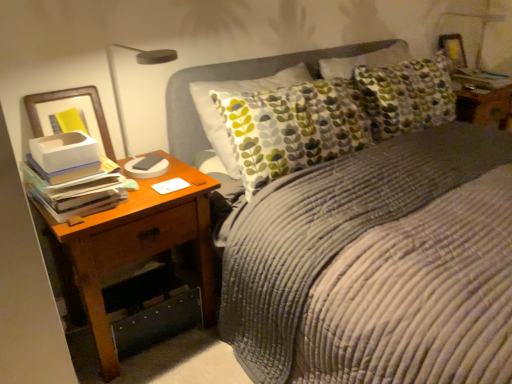
Question: From a real-world perspective, is brown wood nightstand at left below corduroy fabric bed at center?

Choices:
 (A) yes
 (B) no

Answer: (A)

Question: Considering the relative positions of brown wood nightstand at left and corduroy fabric bed at center in the image provided, is brown wood nightstand at left in front of corduroy fabric bed at center?

Choices:
 (A) no
 (B) yes

Answer: (A)

Question: From the image's perspective, is brown wood nightstand at left on corduroy fabric bed at center?

Choices:
 (A) no
 (B) yes

Answer: (A)

Question: Would you consider brown wood nightstand at left to be distant from corduroy fabric bed at center?

Choices:
 (A) no
 (B) yes

Answer: (A)

Question: Is brown wood nightstand at left located outside corduroy fabric bed at center?

Choices:
 (A) yes
 (B) no

Answer: (B)

Question: Considering the relative sizes of brown wood nightstand at left and corduroy fabric bed at center in the image provided, is brown wood nightstand at left thinner than corduroy fabric bed at center?

Choices:
 (A) no
 (B) yes

Answer: (B)

Question: Does corduroy fabric bed at center appear on the right side of brown wood nightstand at left?

Choices:
 (A) no
 (B) yes

Answer: (B)

Question: From a real-world perspective, is corduroy fabric bed at center located beneath brown wood nightstand at left?

Choices:
 (A) no
 (B) yes

Answer: (A)

Question: From a real-world perspective, is corduroy fabric bed at center located higher than brown wood nightstand at left?

Choices:
 (A) yes
 (B) no

Answer: (A)

Question: Is corduroy fabric bed at center touching brown wood nightstand at left?

Choices:
 (A) yes
 (B) no

Answer: (B)

Question: From the image's perspective, would you say corduroy fabric bed at center is positioned over brown wood nightstand at left?

Choices:
 (A) no
 (B) yes

Answer: (B)

Question: Can you confirm if corduroy fabric bed at center is smaller than brown wood nightstand at left?

Choices:
 (A) no
 (B) yes

Answer: (A)

Question: From a real-world perspective, is white paper stack at left below brown wood nightstand at left?

Choices:
 (A) no
 (B) yes

Answer: (A)